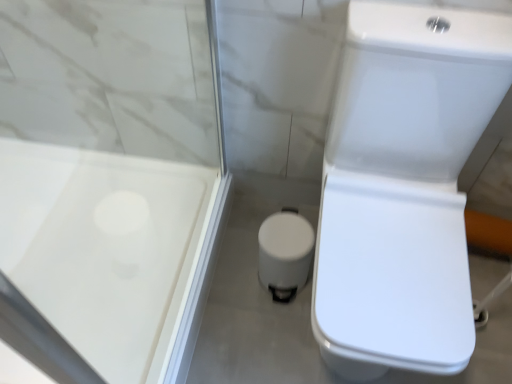
Describe the element at coordinates (403, 187) in the screenshot. I see `white glossy toilet at right` at that location.

What is the approximate height of white glossy toilet at right?

It is 32.99 inches.

What do you see at coordinates (285, 253) in the screenshot?
I see `white glossy trash can at center` at bounding box center [285, 253].

I want to click on transparent plastic screen door at upper left, so click(x=114, y=200).

From the image's perspective, relative to white glossy trash can at center, is transparent plastic screen door at upper left above or below?

Based on their image positions, transparent plastic screen door at upper left is located above white glossy trash can at center.

Is transparent plastic screen door at upper left positioned with its back to white glossy trash can at center?

No, transparent plastic screen door at upper left's orientation is not away from white glossy trash can at center.

Does transparent plastic screen door at upper left lie in front of white glossy trash can at center?

Yes, it is.

Does white glossy toilet at right turn towards transparent plastic screen door at upper left?

No, white glossy toilet at right is not oriented towards transparent plastic screen door at upper left.

In terms of size, does white glossy toilet at right appear bigger or smaller than transparent plastic screen door at upper left?

Considering their sizes, white glossy toilet at right takes up more space than transparent plastic screen door at upper left.

Can you confirm if white glossy toilet at right is positioned to the right of transparent plastic screen door at upper left?

Yes, white glossy toilet at right is to the right of transparent plastic screen door at upper left.

Considering the sizes of white glossy toilet at right and transparent plastic screen door at upper left in the image, is white glossy toilet at right taller or shorter than transparent plastic screen door at upper left?

white glossy toilet at right is shorter than transparent plastic screen door at upper left.

From a real-world perspective, is white glossy toilet at right located beneath white glossy trash can at center?

No.

How far apart are white glossy toilet at right and white glossy trash can at center?

A distance of 14.46 inches exists between white glossy toilet at right and white glossy trash can at center.

Can you see white glossy toilet at right touching white glossy trash can at center?

No.

Is white glossy trash can at center at the back of white glossy toilet at right?

white glossy toilet at right does not have its back to white glossy trash can at center.

Consider the image. Is transparent plastic screen door at upper left positioned with its back to white glossy toilet at right?

transparent plastic screen door at upper left is not turned away from white glossy toilet at right.

Considering the positions of objects transparent plastic screen door at upper left and white glossy toilet at right in the image provided, who is in front, transparent plastic screen door at upper left or white glossy toilet at right?

transparent plastic screen door at upper left is more forward.

Is transparent plastic screen door at upper left at the left side of white glossy toilet at right?

Yes.

Based on the photo, how far apart are white glossy trash can at center and white glossy toilet at right?

36.73 centimeters.

Can you tell me how much white glossy trash can at center and white glossy toilet at right differ in facing direction?

The angle between the facing direction of white glossy trash can at center and the facing direction of white glossy toilet at right is 0.0015 degrees.

In the scene shown: Which is less distant, (259,238) or (374,187)?

Point (259,238) appears to be farther away from the viewer than point (374,187).

Can you confirm if white glossy trash can at center is positioned to the right of white glossy toilet at right?

No, white glossy trash can at center is not to the right of white glossy toilet at right.

Would you say white glossy trash can at center is outside transparent plastic screen door at upper left?

white glossy trash can at center lies outside transparent plastic screen door at upper left's area.

Can you confirm if white glossy trash can at center is wider than transparent plastic screen door at upper left?

Incorrect, the width of white glossy trash can at center does not surpass that of transparent plastic screen door at upper left.

Is white glossy trash can at center directly adjacent to transparent plastic screen door at upper left?

No, white glossy trash can at center is not beside transparent plastic screen door at upper left.

Considering the positions of objects white glossy trash can at center and transparent plastic screen door at upper left in the image provided, who is behind, white glossy trash can at center or transparent plastic screen door at upper left?

white glossy trash can at center is further from the camera.

At what (x,y) coordinates should I click in order to perform the action: click on screen door above the white glossy trash can at center (from the image's perspective). Please return your answer as a coordinate pair (x, y). Looking at the image, I should click on (114, 200).

At what (x,y) coordinates should I click in order to perform the action: click on screen door in front of the white glossy toilet at right. Please return your answer as a coordinate pair (x, y). Image resolution: width=512 pixels, height=384 pixels. Looking at the image, I should click on (114, 200).

Which object lies further to the anchor point white glossy toilet at right, white glossy trash can at center or transparent plastic screen door at upper left?

transparent plastic screen door at upper left lies further to white glossy toilet at right than the other object.

When comparing their distances from transparent plastic screen door at upper left, does white glossy trash can at center or white glossy toilet at right seem closer?

white glossy trash can at center.

When comparing their distances from white glossy trash can at center, does transparent plastic screen door at upper left or white glossy toilet at right seem further?

Among the two, transparent plastic screen door at upper left is located further to white glossy trash can at center.

From the image, which object appears to be nearer to transparent plastic screen door at upper left, white glossy toilet at right or white glossy trash can at center?

white glossy trash can at center is positioned closer to the anchor transparent plastic screen door at upper left.

From the image, which object appears to be farther from white glossy toilet at right, transparent plastic screen door at upper left or white glossy trash can at center?

Based on the image, transparent plastic screen door at upper left appears to be further to white glossy toilet at right.

Which object lies further to the anchor point white glossy trash can at center, white glossy toilet at right or transparent plastic screen door at upper left?

Among the two, transparent plastic screen door at upper left is located further to white glossy trash can at center.

Locate an element on the screen. The width and height of the screenshot is (512, 384). toilet between transparent plastic screen door at upper left and white glossy trash can at center from front to back is located at coordinates (403, 187).